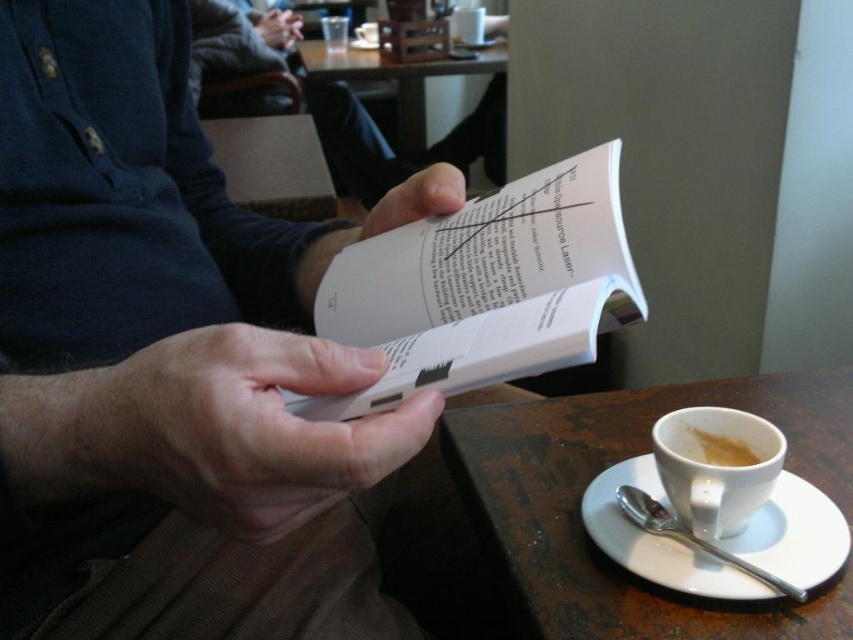
Question: Is smooth skin hand at center above white ceramic saucer at lower right?

Choices:
 (A) no
 (B) yes

Answer: (B)

Question: Is white ceramic saucer at lower right positioned behind white paper at center?

Choices:
 (A) yes
 (B) no

Answer: (B)

Question: Estimate the real-world distances between objects in this image. Which object is farther from the smooth skin hand at upper center?

Choices:
 (A) white matte cup at lower right
 (B) white ceramic saucer at lower right
 (C) brown wooden table at lower right

Answer: (A)

Question: Does smooth skin hand at center have a smaller size compared to white matte cup at lower right?

Choices:
 (A) yes
 (B) no

Answer: (B)

Question: Which of the following is the farthest from the observer?

Choices:
 (A) pos(421,193)
 (B) pos(122,365)

Answer: (A)

Question: Which point is farther to the camera?

Choices:
 (A) (120, 378)
 (B) (370, 45)

Answer: (B)